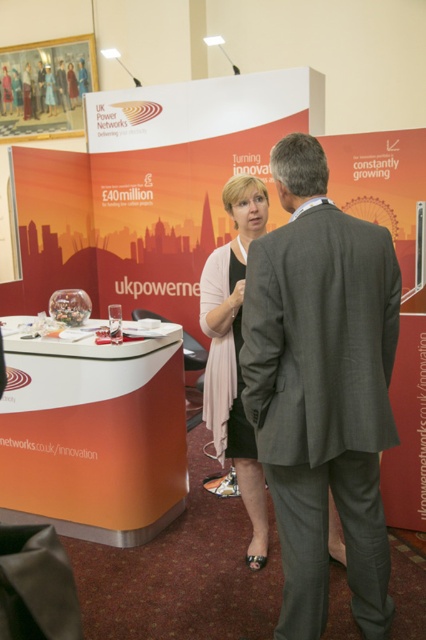
Question: Among these points, which one is farthest from the camera?

Choices:
 (A) (199, 321)
 (B) (307, 364)

Answer: (A)

Question: Is gray wool suit at center in front of pink fabric dress at center?

Choices:
 (A) no
 (B) yes

Answer: (B)

Question: Is gray wool suit at center below pink fabric dress at center?

Choices:
 (A) yes
 (B) no

Answer: (A)

Question: Which point is closer to the camera?

Choices:
 (A) (215, 449)
 (B) (307, 164)

Answer: (B)

Question: Among these points, which one is farthest from the camera?

Choices:
 (A) (305, 506)
 (B) (244, 264)

Answer: (B)

Question: Is gray wool suit at center positioned in front of pink fabric dress at center?

Choices:
 (A) yes
 (B) no

Answer: (A)